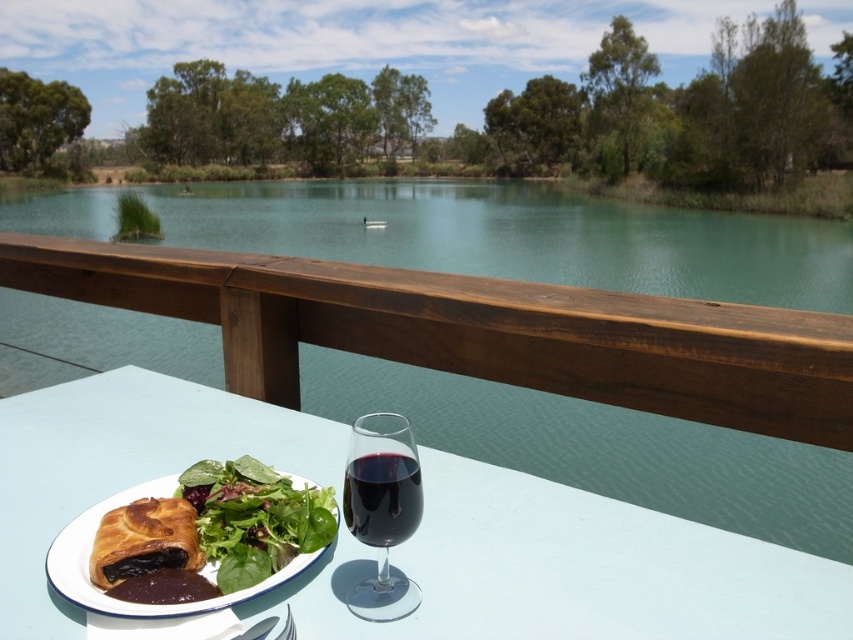
Question: Is green leafy salad at center smaller than transparent glass at center?

Choices:
 (A) yes
 (B) no

Answer: (B)

Question: Which point is farther from the camera taking this photo?

Choices:
 (A) (33, 536)
 (B) (372, 460)

Answer: (A)

Question: Which point appears farthest from the camera in this image?

Choices:
 (A) (236, 536)
 (B) (364, 509)
 (C) (73, 593)

Answer: (A)

Question: Can you confirm if matte brown pastry at center is smaller than dark red glass at center?

Choices:
 (A) no
 (B) yes

Answer: (A)

Question: Considering the real-world distances, which object is farthest from the white glossy table at lower center?

Choices:
 (A) matte brown pastry at center
 (B) dark red glass at center

Answer: (B)

Question: Is clear water at table center behind white glossy table at lower center?

Choices:
 (A) yes
 (B) no

Answer: (A)